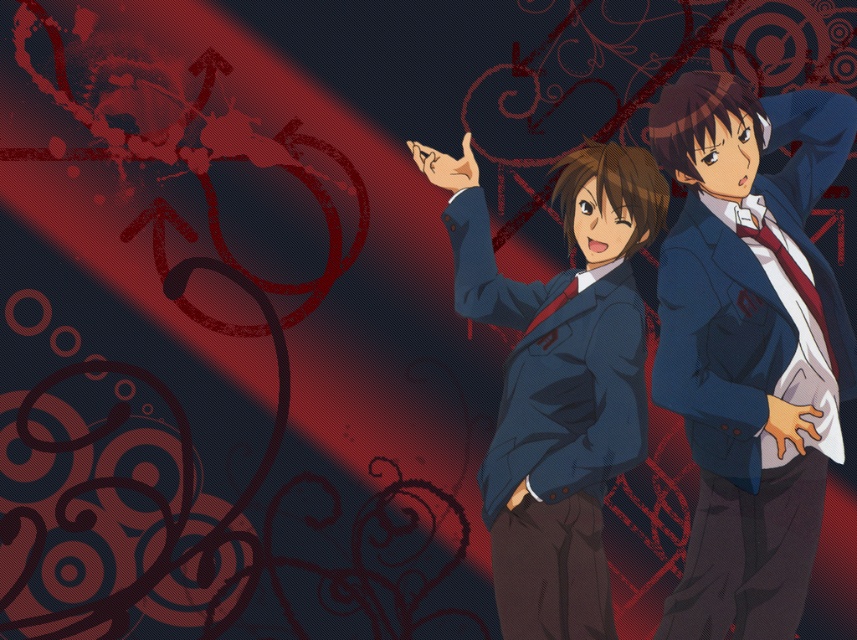
Is matte blue blazer at right bigger than matte blue blazer at center?

Correct, matte blue blazer at right is larger in size than matte blue blazer at center.

Between matte blue blazer at right and matte blue blazer at center, which one is positioned lower?

Positioned lower is matte blue blazer at center.

At what (x,y) coordinates should I click in order to perform the action: click on matte blue blazer at right. Please return your answer as a coordinate pair (x, y). The image size is (857, 640). Looking at the image, I should click on (748, 346).